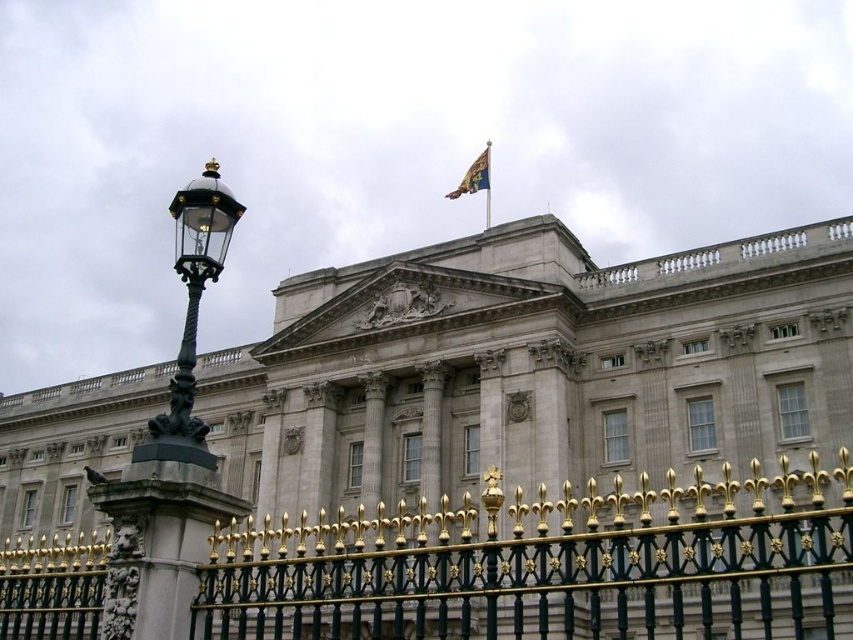
Based on the scene description, is the stone facade building at center positioned to the left or right of the gold textured flag at upper center?

The stone facade building at center is to the left of the gold textured flag at upper center.